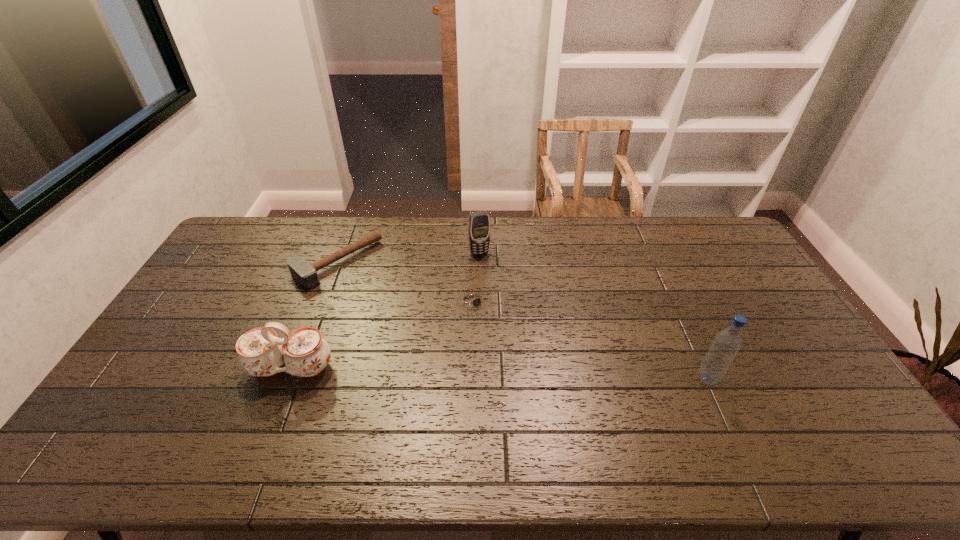
I want to click on vacant space at the left edge, so click(x=188, y=342).

I want to click on blank space at the right edge, so click(765, 357).

This screenshot has height=540, width=960. Identify the location of vacant point at the far right corner. (684, 231).

The image size is (960, 540). In order to click on free space at the near right corner in this screenshot , I will do `click(809, 415)`.

Identify the location of empty space that is in between the rightmost object and the cellular telephone. This screenshot has width=960, height=540. (593, 316).

At what (x,y) coordinates should I click in order to perform the action: click on free point between the cellular telephone and the chinaware. Please return your answer as a coordinate pair (x, y). The width and height of the screenshot is (960, 540). Looking at the image, I should click on (385, 310).

Locate an element on the screen. Image resolution: width=960 pixels, height=540 pixels. unoccupied position between the cellular telephone and the tallest object is located at coordinates (593, 316).

You are a GUI agent. You are given a task and a screenshot of the screen. Output one action in this format:
    pyautogui.click(x=<x>, y=<y>)
    Task: Click on the vacant space in between the cellular telephone and the watch
    Image resolution: width=960 pixels, height=540 pixels.
    Given the screenshot: What is the action you would take?
    pyautogui.click(x=477, y=277)

You are a GUI agent. You are given a task and a screenshot of the screen. Output one action in this format:
    pyautogui.click(x=<x>, y=<y>)
    Task: Click on the vacant point located between the chinaware and the rightmost object
    
    Given the screenshot: What is the action you would take?
    pyautogui.click(x=499, y=373)

Identify the location of vacant space in between the hammer and the rightmost object. (522, 321).